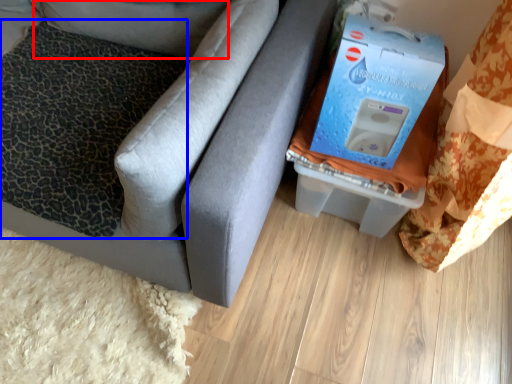
Question: Which point is closer to the camera, pillow (highlighted by a red box) or pillow (highlighted by a blue box)?

Choices:
 (A) pillow
 (B) pillow

Answer: (B)